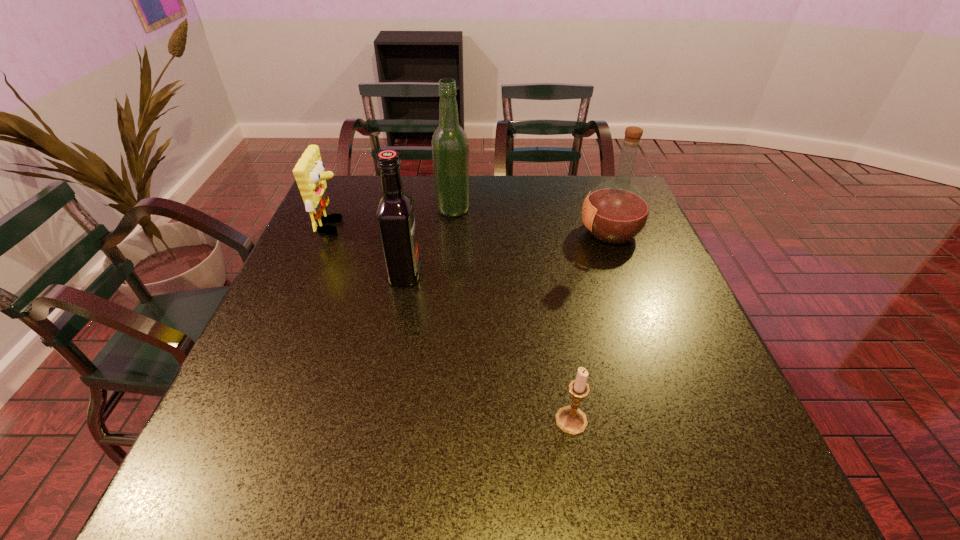
Where is `free space located on the front label of the rightmost liquor`? The image size is (960, 540). free space located on the front label of the rightmost liquor is located at coordinates (486, 232).

This screenshot has height=540, width=960. I want to click on free location located on the front label of the rightmost liquor, so click(471, 232).

Find the location of a particular element. The image size is (960, 540). vacant space located on the front label of the rightmost liquor is located at coordinates (471, 232).

Where is `free space located 0.320m on the face of the fourth tallest object`? This screenshot has width=960, height=540. free space located 0.320m on the face of the fourth tallest object is located at coordinates (458, 226).

I want to click on free region located 0.080m on the right of the shortest object, so click(631, 421).

Identify the location of sponge present at the far edge. (309, 173).

What are the coordinates of `object located in the left edge section of the desktop` in the screenshot? It's located at (309, 173).

Image resolution: width=960 pixels, height=540 pixels. What are the coordinates of `object that is at the right edge` in the screenshot? It's located at (615, 212).

Find the location of a particular element. The width and height of the screenshot is (960, 540). object that is at the far left corner is located at coordinates 309,173.

Where is `object that is positioned at the far right corner`? The height and width of the screenshot is (540, 960). object that is positioned at the far right corner is located at coordinates (615, 212).